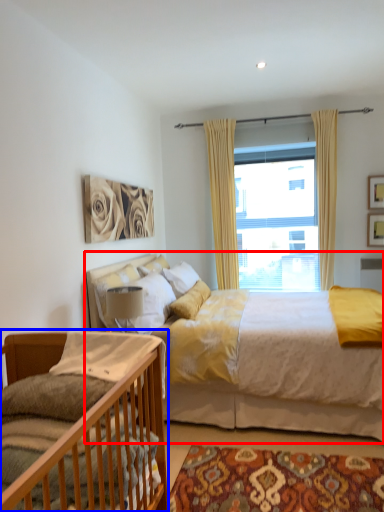
Question: Which object appears closest to the camera in this image, bed (highlighted by a red box) or bed (highlighted by a blue box)?

Choices:
 (A) bed
 (B) bed

Answer: (B)